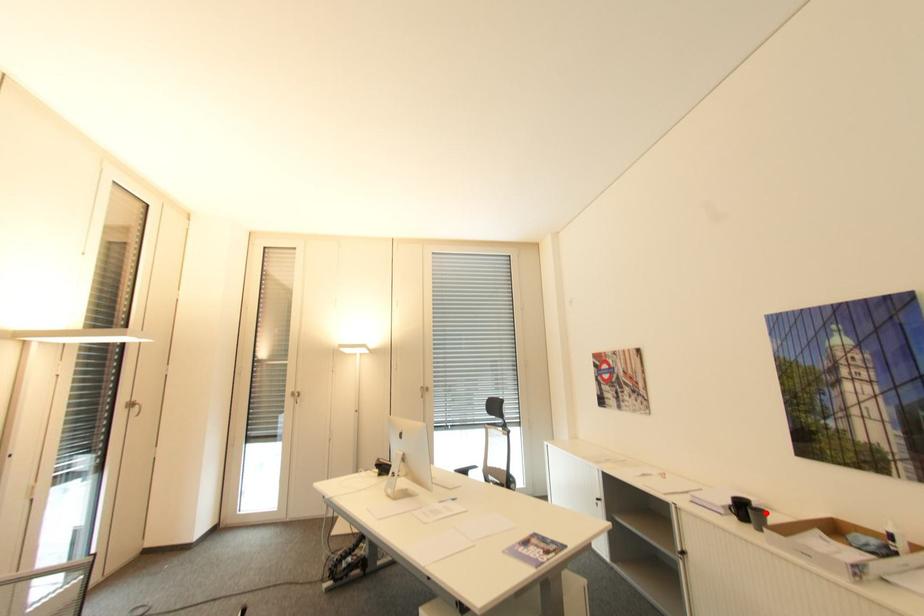
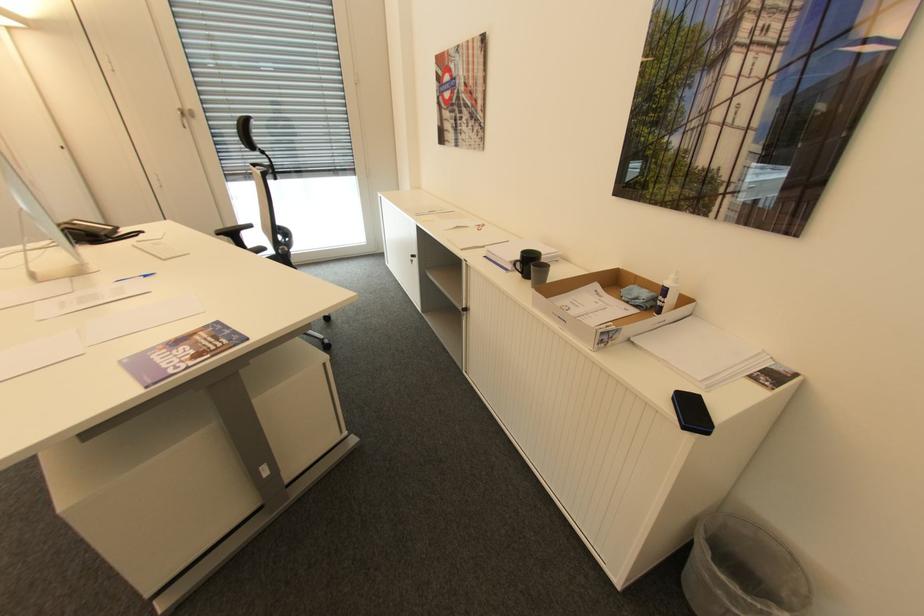
Find the pixel in the second image that matches the highlighted location in the first image.

(550, 268)